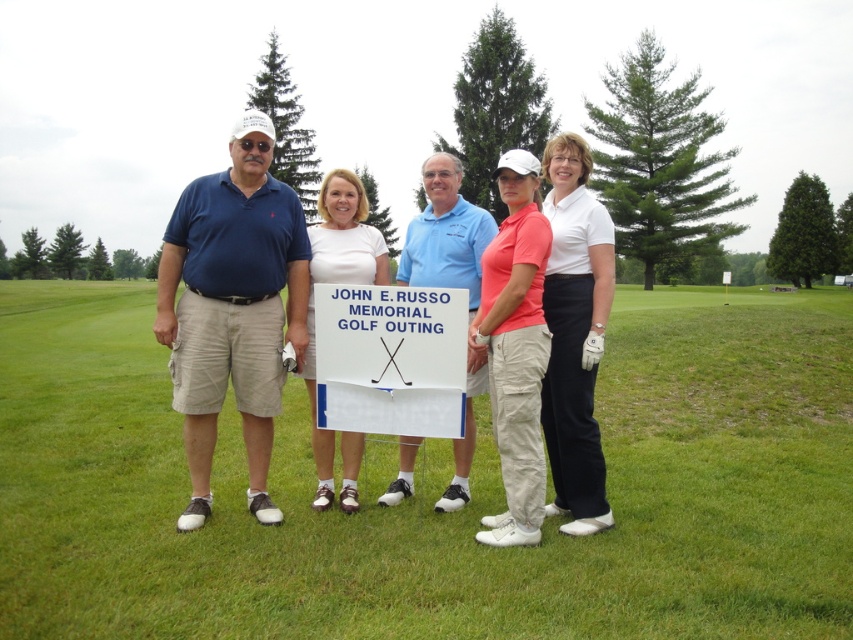
You are a photographer setting up for a group photo at the golf course. You notice the green grass at center and the white matte signboard at center. Which object is located above the other?

The white matte signboard at center is above the green grass at center because the green grass at center is positioned under it.

You are a photographer trying to frame the matte coral shirt at center and the blue cotton polo shirt at center in your shot. Which of the two shirts should you focus on to ensure it takes up more of the frame?

The blue cotton polo shirt at center occupies more space than the matte coral shirt at center, so focusing on the blue cotton polo shirt at center would ensure it takes up more of the frame.